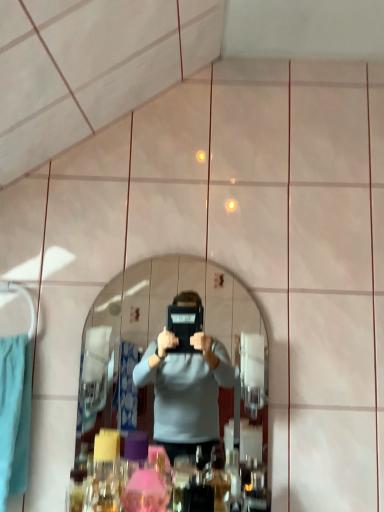
Where is `teal towel at left`? The height and width of the screenshot is (512, 384). teal towel at left is located at coordinates (14, 414).

The width and height of the screenshot is (384, 512). What do you see at coordinates (14, 414) in the screenshot?
I see `teal towel at left` at bounding box center [14, 414].

Locate an element on the screen. clear glass mirror at center is located at coordinates (160, 330).

Describe the element at coordinates (160, 330) in the screenshot. I see `clear glass mirror at center` at that location.

Measure the distance between point (260,417) and camera.

The distance of point (260,417) from camera is 3.69 feet.

The height and width of the screenshot is (512, 384). In order to click on teal towel at left in this screenshot , I will do click(14, 414).

Is clear glass mirror at center to the left or to the right of teal towel at left in the image?

From the image, it's evident that clear glass mirror at center is to the right of teal towel at left.

Which is behind, clear glass mirror at center or teal towel at left?

clear glass mirror at center is behind.

Which is closer, (109,288) or (4,493)?

Clearly, point (109,288) is more distant from the camera than point (4,493).

From the image's perspective, is clear glass mirror at center located above or below teal towel at left?

clear glass mirror at center is situated higher than teal towel at left in the image.

From a real-world perspective, is clear glass mirror at center positioned above or below teal towel at left?

Clearly, from a real-world perspective, clear glass mirror at center is above teal towel at left.

Is clear glass mirror at center wider than teal towel at left?

No, clear glass mirror at center is not wider than teal towel at left.

Consider the image. Between clear glass mirror at center and teal towel at left, which one has less height?

teal towel at left is shorter.

Consider the image. Is clear glass mirror at center bigger than teal towel at left?

Actually, clear glass mirror at center might be smaller than teal towel at left.

Is teal towel at left inside clear glass mirror at center?

No, clear glass mirror at center does not contain teal towel at left.

Is clear glass mirror at center in contact with teal towel at left?

No, clear glass mirror at center is not next to teal towel at left.

Is clear glass mirror at center looking in the opposite direction of teal towel at left?

No, clear glass mirror at center is not facing the opposite direction of teal towel at left.

Measure the distance between clear glass mirror at center and teal towel at left.

clear glass mirror at center is 1.15 meters away from teal towel at left.

Identify the location of clothe below the clear glass mirror at center (from the image's perspective). The width and height of the screenshot is (384, 512). (14, 414).

Looking at this image, would you say teal towel at left is to the left or to the right of clear glass mirror at center in the picture?

Clearly, teal towel at left is on the left of clear glass mirror at center in the image.

In the scene shown: Which object is further away from the camera, teal towel at left or clear glass mirror at center?

clear glass mirror at center.

Which is in front, point (14, 490) or point (170, 357)?

Positioned in front is point (14, 490).

From the image's perspective, which is above, teal towel at left or clear glass mirror at center?

From the image's view, clear glass mirror at center is above.

From a real-world perspective, is teal towel at left located higher than clear glass mirror at center?

A: Incorrect, from a real-world perspective, teal towel at left is lower than clear glass mirror at center.

Can you confirm if teal towel at left is thinner than clear glass mirror at center?

No.

Who is taller, teal towel at left or clear glass mirror at center?

clear glass mirror at center is taller.

Is teal towel at left bigger than clear glass mirror at center?

Yes, teal towel at left is bigger than clear glass mirror at center.

Is teal towel at left located outside clear glass mirror at center?

Yes.

Is teal towel at left with clear glass mirror at center?

No, teal towel at left is not in contact with clear glass mirror at center.

Is teal towel at left oriented away from clear glass mirror at center?

No, teal towel at left's orientation is not away from clear glass mirror at center.

What's the angular difference between teal towel at left and clear glass mirror at center's facing directions?

The angular difference between teal towel at left and clear glass mirror at center is 0.00122 degrees.

Measure the distance from teal towel at left to clear glass mirror at center.

teal towel at left is 3.77 feet from clear glass mirror at center.

Locate an element on the screen. This screenshot has height=512, width=384. clothe in front of the clear glass mirror at center is located at coordinates (14, 414).

The height and width of the screenshot is (512, 384). In order to click on clothe below the clear glass mirror at center (from a real-world perspective) in this screenshot , I will do `click(14, 414)`.

At what (x,y) coordinates should I click in order to perform the action: click on clothe in front of the clear glass mirror at center. Please return your answer as a coordinate pair (x, y). Image resolution: width=384 pixels, height=512 pixels. Looking at the image, I should click on (14, 414).